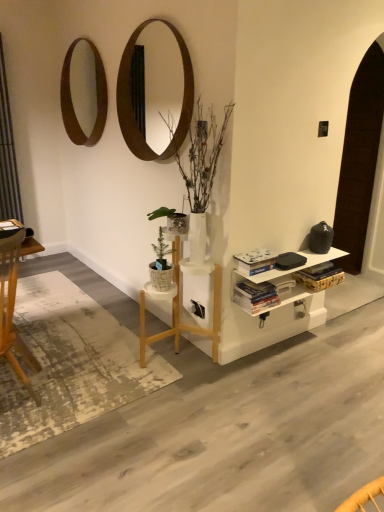
In order to click on vacant area situated below wooden desk at left (from a real-world perspective) in this screenshot , I will do `click(23, 343)`.